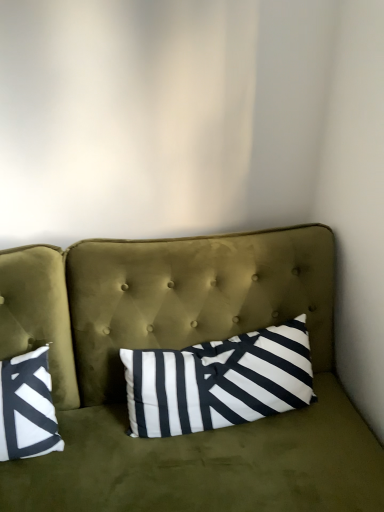
The image size is (384, 512). What do you see at coordinates (181, 348) in the screenshot? I see `olive green velvet couch at center` at bounding box center [181, 348].

You are a GUI agent. You are given a task and a screenshot of the screen. Output one action in this format:
    pyautogui.click(x=<x>, y=<y>)
    Task: Click on the olive green velvet couch at center
    This screenshot has width=384, height=512.
    Given the screenshot: What is the action you would take?
    pyautogui.click(x=181, y=348)

The height and width of the screenshot is (512, 384). What do you see at coordinates (219, 381) in the screenshot?
I see `white striped pillow at center` at bounding box center [219, 381].

The image size is (384, 512). What are the coordinates of `white striped pillow at center` in the screenshot? It's located at (219, 381).

Locate an element on the screen. olive green velvet couch at center is located at coordinates (181, 348).

Is olive green velvet couch at center to the left of white striped pillow at center from the viewer's perspective?

Indeed, olive green velvet couch at center is positioned on the left side of white striped pillow at center.

Is olive green velvet couch at center closer to the viewer compared to white striped pillow at center?

Yes, it is.

Which is in front, point (2, 276) or point (284, 335)?

The point (2, 276) is closer to the camera.

From the image's perspective, is olive green velvet couch at center below white striped pillow at center?

Yes, from the image's perspective, olive green velvet couch at center is below white striped pillow at center.

From a real-world perspective, is olive green velvet couch at center on top of white striped pillow at center?

Incorrect, from a real-world perspective, olive green velvet couch at center is lower than white striped pillow at center.

Can you confirm if olive green velvet couch at center is thinner than white striped pillow at center?

No.

Considering the relative sizes of olive green velvet couch at center and white striped pillow at center in the image provided, is olive green velvet couch at center shorter than white striped pillow at center?

Incorrect, the height of olive green velvet couch at center does not fall short of that of white striped pillow at center.

Considering the relative sizes of olive green velvet couch at center and white striped pillow at center in the image provided, is olive green velvet couch at center smaller than white striped pillow at center?

No.

Is olive green velvet couch at center located outside white striped pillow at center?

Yes, olive green velvet couch at center is not within white striped pillow at center.

Would you say olive green velvet couch at center is a long distance from white striped pillow at center?

olive green velvet couch at center is actually quite close to white striped pillow at center.

Is olive green velvet couch at center facing away from white striped pillow at center?

Correct, olive green velvet couch at center is looking away from white striped pillow at center.

How much distance is there between olive green velvet couch at center and white striped pillow at center?

They are 4.94 inches apart.

Image resolution: width=384 pixels, height=512 pixels. What are the coordinates of `pillow above the olive green velvet couch at center (from the image's perspective)` in the screenshot? It's located at (219, 381).

Considering the positions of objects white striped pillow at center and olive green velvet couch at center in the image provided, who is more to the left, white striped pillow at center or olive green velvet couch at center?

From the viewer's perspective, olive green velvet couch at center appears more on the left side.

Is the position of white striped pillow at center more distant than that of olive green velvet couch at center?

Yes, white striped pillow at center is further from the viewer.

Which is closer, (244, 358) or (64, 332)?

Positioned in front is point (244, 358).

From the image's perspective, is white striped pillow at center positioned above or below olive green velvet couch at center?

Based on their image positions, white striped pillow at center is located above olive green velvet couch at center.

From a real-world perspective, is white striped pillow at center physically located above or below olive green velvet couch at center?

white striped pillow at center is situated higher than olive green velvet couch at center in the real world.

Which of these two, white striped pillow at center or olive green velvet couch at center, is wider?

With larger width is olive green velvet couch at center.

Considering the relative sizes of white striped pillow at center and olive green velvet couch at center in the image provided, is white striped pillow at center taller than olive green velvet couch at center?

In fact, white striped pillow at center may be shorter than olive green velvet couch at center.

Based on their sizes in the image, would you say white striped pillow at center is bigger or smaller than olive green velvet couch at center?

In the image, white striped pillow at center appears to be smaller than olive green velvet couch at center.

Is white striped pillow at center situated inside olive green velvet couch at center or outside?

white striped pillow at center fits inside olive green velvet couch at center.

Based on the photo, is white striped pillow at center positioned far away from olive green velvet couch at center?

Actually, white striped pillow at center and olive green velvet couch at center are a little close together.

Is white striped pillow at center looking in the opposite direction of olive green velvet couch at center?

Yes, olive green velvet couch at center is at the back of white striped pillow at center.

Measure the distance between white striped pillow at center and olive green velvet couch at center.

They are 4.94 inches apart.

Identify the location of studio couch directly beneath the white striped pillow at center (from a real-world perspective). The height and width of the screenshot is (512, 384). [181, 348].

Find the location of `studio couch that is under the white striped pillow at center (from a real-world perspective)`. studio couch that is under the white striped pillow at center (from a real-world perspective) is located at coordinates (181, 348).

What are the coordinates of `pillow above the olive green velvet couch at center (from the image's perspective)` in the screenshot? It's located at (219, 381).